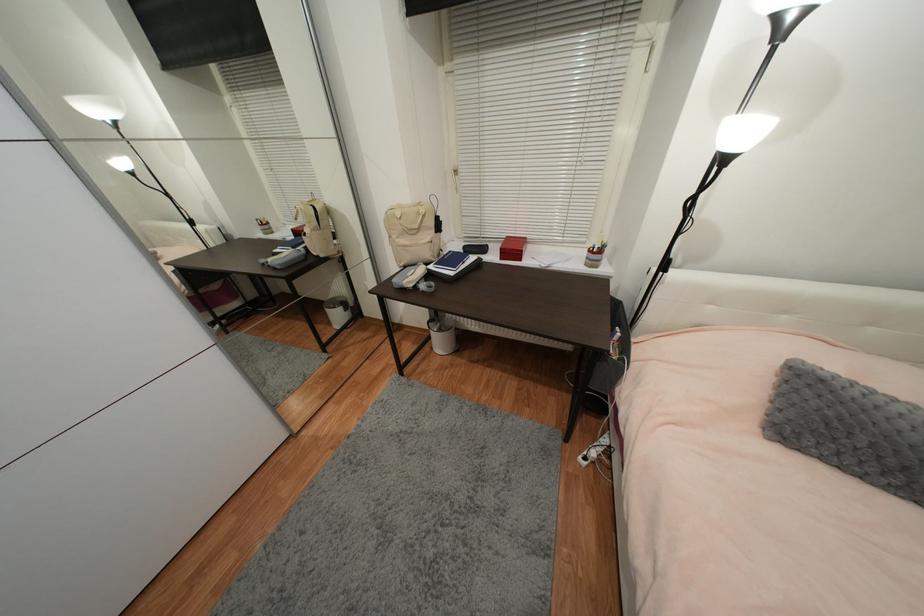
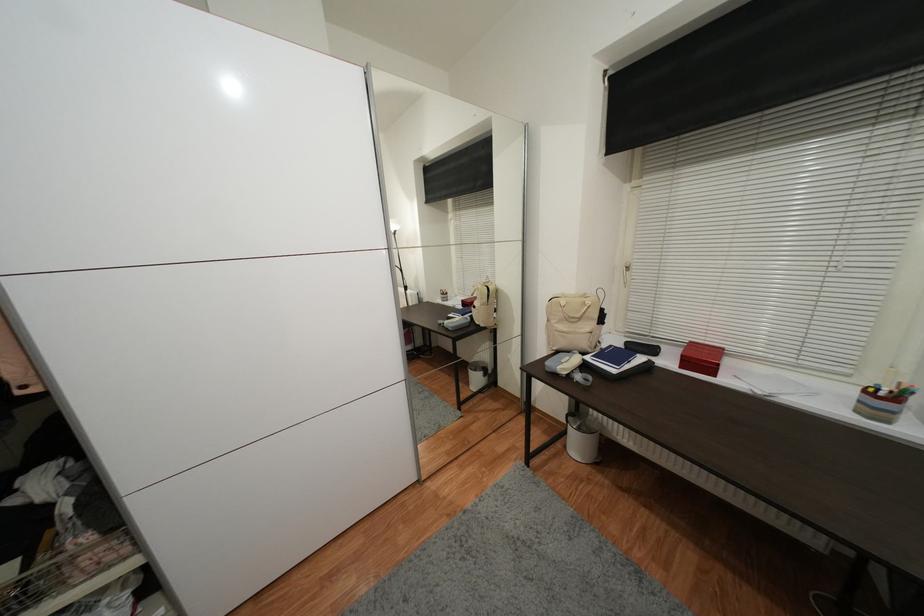
The point at (422, 215) is marked in the first image. Where is the corresponding point in the second image?

(589, 305)